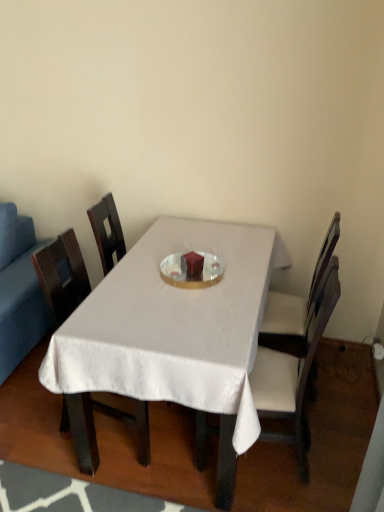
The image size is (384, 512). Identify the location of vacant space positioned to the left of wooden chair at center, marked as the first chair in a left-to-right arrangement. (31, 433).